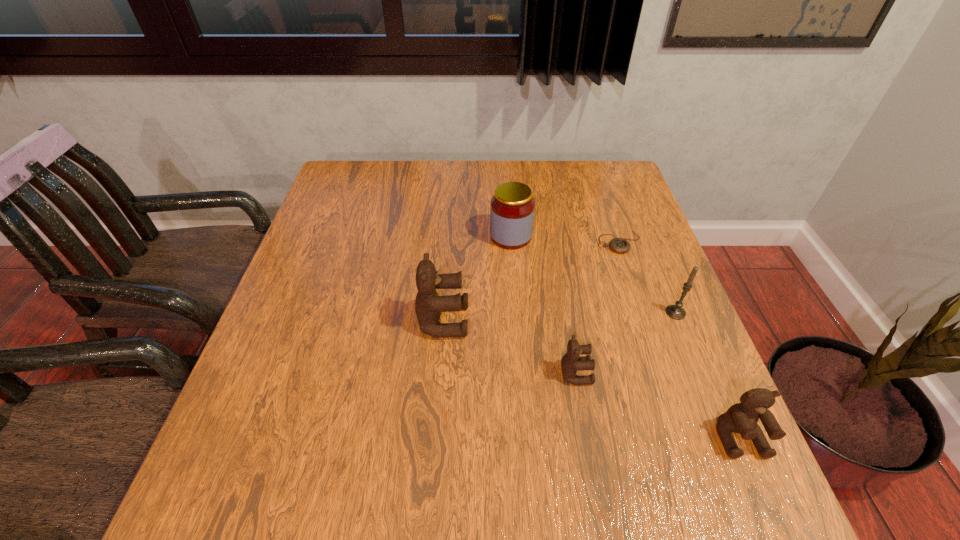
Given the evenly spaced teddy bears in the image, where should an extra teddy bear be added on the left to preserve the spacing? Please point to a vacant space. Please provide its 2D coordinates. Your answer should be formatted as a tuple, i.e. [(x, y)], where the tuple contains the x and y coordinates of a point satisfying the conditions above.

[(334, 278)]